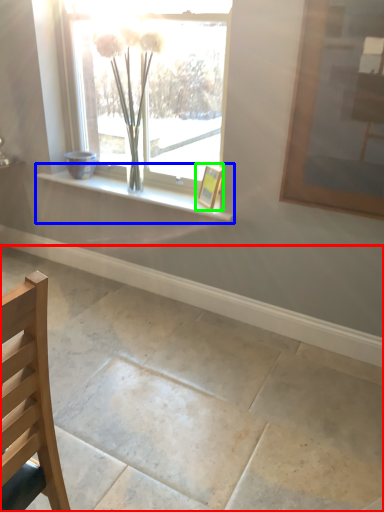
Question: Based on their relative distances, which object is farther from concrete (highlighted by a red box)? Choose from window sill (highlighted by a blue box) and picture frame (highlighted by a green box).

Choices:
 (A) window sill
 (B) picture frame

Answer: (B)